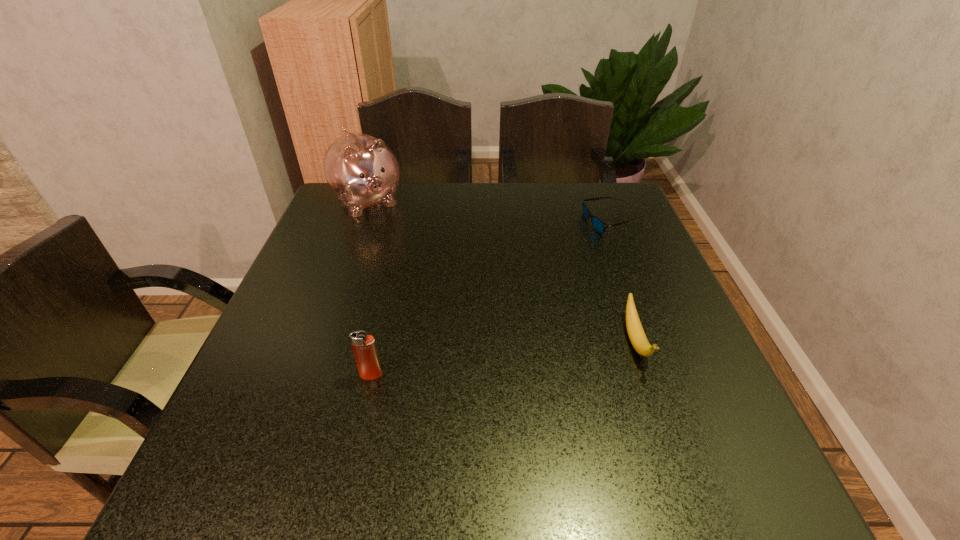
Identify the location of free region at the near edge of the desktop. (380, 402).

Identify the location of vacant area at the left edge. (304, 323).

You are a GUI agent. You are given a task and a screenshot of the screen. Output one action in this format:
    pyautogui.click(x=<x>, y=<y>)
    Task: Click on the free space at the right edge of the desktop
    Image resolution: width=960 pixels, height=540 pixels.
    Given the screenshot: What is the action you would take?
    pyautogui.click(x=681, y=352)

At what (x,y) coordinates should I click in order to perform the action: click on blank space at the far left corner. Please return your answer as a coordinate pair (x, y). The image size is (960, 540). Looking at the image, I should click on (321, 217).

This screenshot has height=540, width=960. What are the coordinates of `vacant space at the far right corner` in the screenshot? It's located at [598, 188].

At what (x,y) coordinates should I click in order to perform the action: click on vacant space in between the piggy bank and the third shortest object. Please return your answer as a coordinate pair (x, y). Image resolution: width=960 pixels, height=540 pixels. Looking at the image, I should click on (370, 288).

Where is `vacant area that lies between the sunglasses and the banana`? Image resolution: width=960 pixels, height=540 pixels. vacant area that lies between the sunglasses and the banana is located at coordinates (624, 282).

This screenshot has width=960, height=540. I want to click on free space between the banana and the piggy bank, so click(x=501, y=272).

The width and height of the screenshot is (960, 540). I want to click on empty space between the tallest object and the second shortest object, so click(501, 272).

Identify the location of free area in between the banana and the shortest object. This screenshot has width=960, height=540. (624, 282).